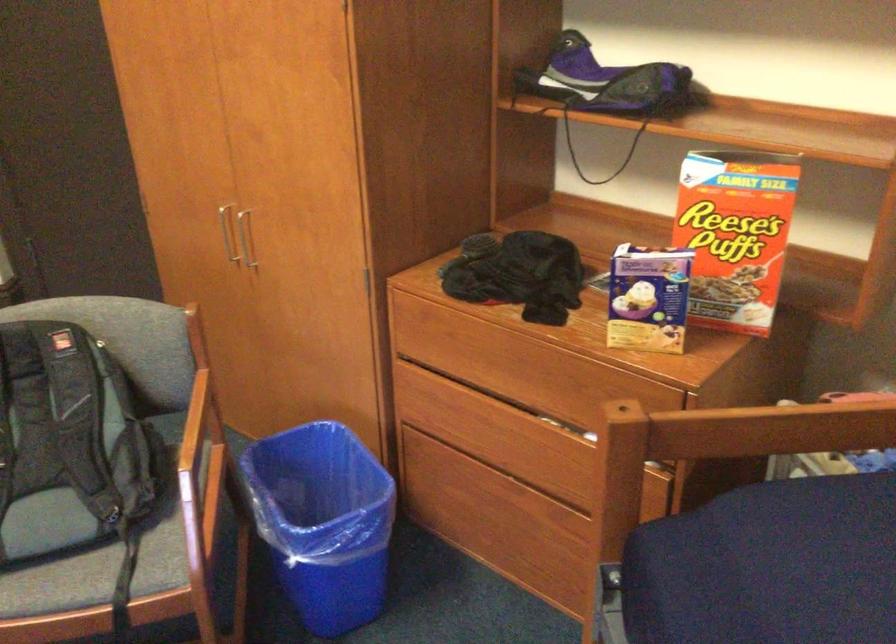
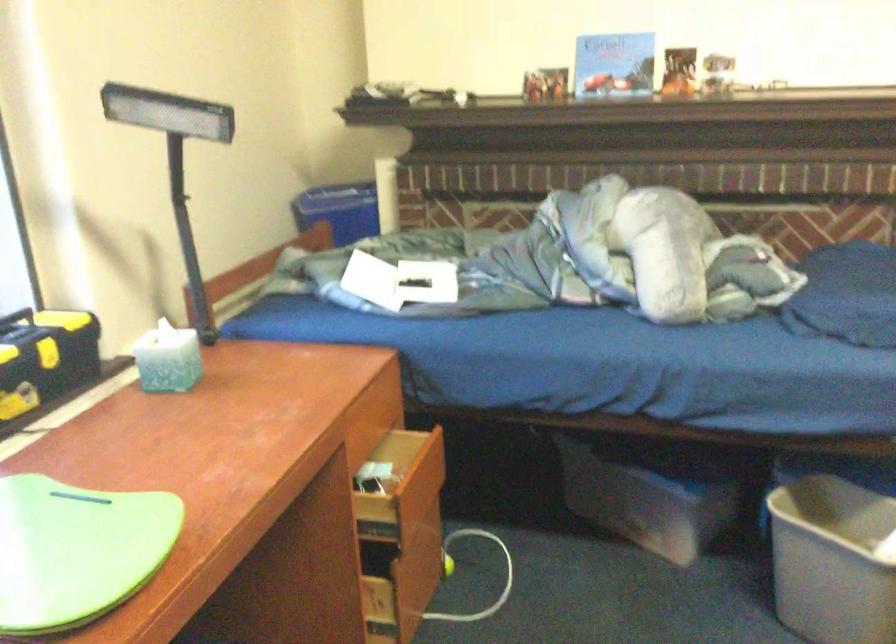
The first image is from the beginning of the video and the second image is from the end. How did the camera likely rotate when shooting the video?

The camera's rotation is toward left-down.